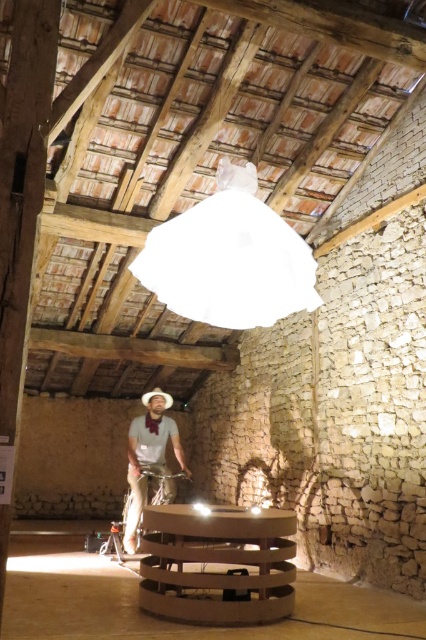
Question: In this image, where is white matte lampshade at upper center located relative to brown felt cowboy hat at center?

Choices:
 (A) above
 (B) below

Answer: (A)

Question: Can you confirm if light brown leather jacket at center is bigger than brown felt cowboy hat at center?

Choices:
 (A) yes
 (B) no

Answer: (A)

Question: Among these objects, which one is nearest to the camera?

Choices:
 (A) light brown leather jacket at center
 (B) white matte lampshade at upper center
 (C) brown felt cowboy hat at center

Answer: (B)

Question: Which object is farther from the camera taking this photo?

Choices:
 (A) brown felt cowboy hat at center
 (B) white matte lampshade at upper center
 (C) light brown leather jacket at center

Answer: (A)

Question: Which object is the closest to the light brown leather jacket at center?

Choices:
 (A) white matte lampshade at upper center
 (B) brown felt cowboy hat at center

Answer: (B)

Question: Can you confirm if white matte lampshade at upper center is positioned above brown felt cowboy hat at center?

Choices:
 (A) yes
 (B) no

Answer: (A)